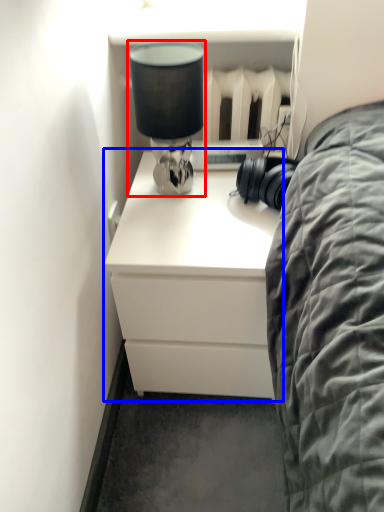
Question: Which of the following is the farthest to the observer, table lamp (highlighted by a red box) or chest of drawers (highlighted by a blue box)?

Choices:
 (A) table lamp
 (B) chest of drawers

Answer: (B)